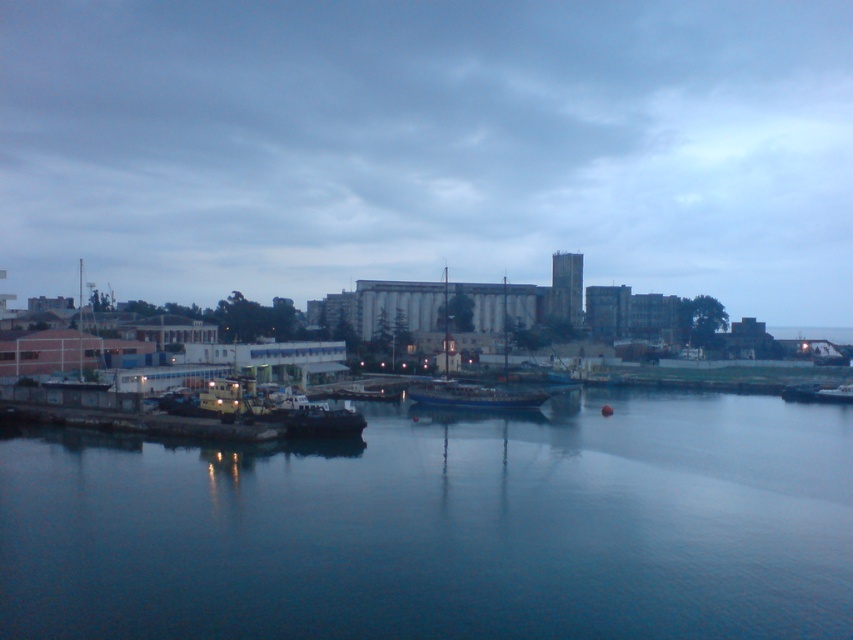
Question: Does blue wooden boat at center come in front of blue metallic boat at center?

Choices:
 (A) yes
 (B) no

Answer: (B)

Question: Based on their relative distances, which object is farther from the dark gray metallic boat at center?

Choices:
 (A) blue smooth water at center
 (B) blue wooden boat at center
 (C) blue metallic boat at center

Answer: (B)

Question: Which point appears farthest from the camera in this image?

Choices:
 (A) (302, 394)
 (B) (444, 406)

Answer: (B)

Question: Does blue smooth water at center appear on the left side of blue wooden boat at center?

Choices:
 (A) no
 (B) yes

Answer: (B)

Question: Which object is positioned closest to the blue wooden boat at center?

Choices:
 (A) dark gray metallic boat at center
 (B) blue metallic boat at center
 (C) blue smooth water at center

Answer: (B)

Question: Can you confirm if blue smooth water at center is thinner than blue metallic boat at center?

Choices:
 (A) no
 (B) yes

Answer: (A)